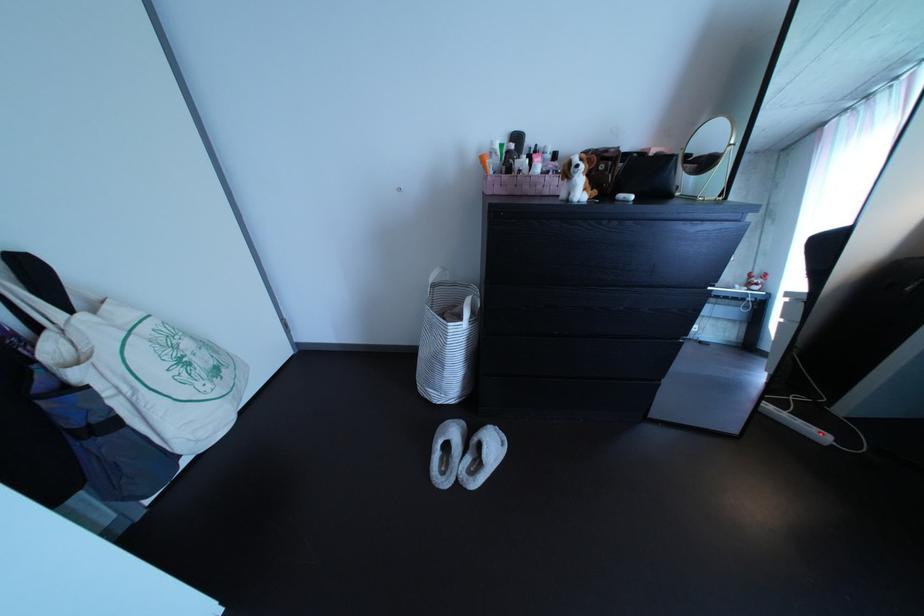
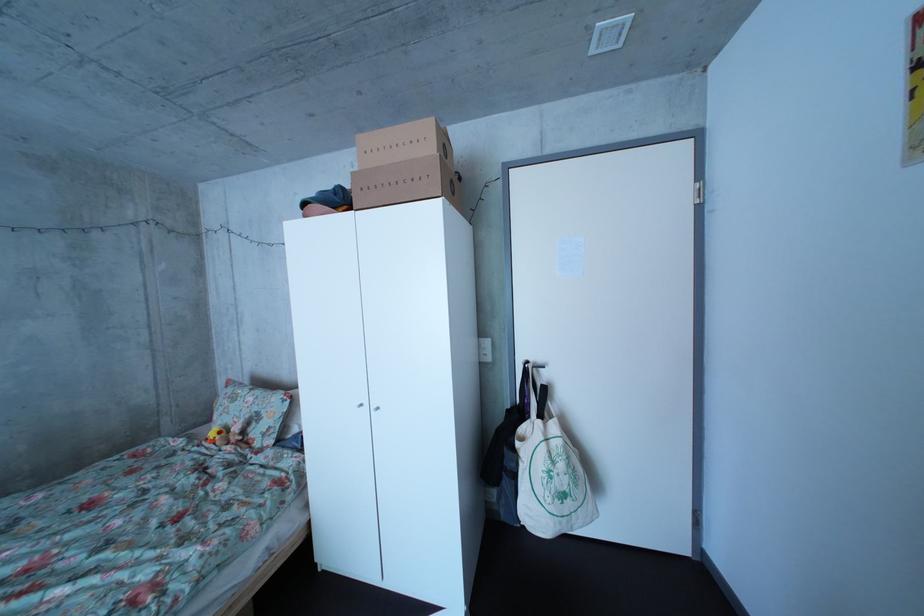
Question: The images are taken continuously from a first-person perspective. In which direction is your viewpoint rotating?

Choices:
 (A) Left
 (B) Right
 (C) Up
 (D) Down

Answer: (A)